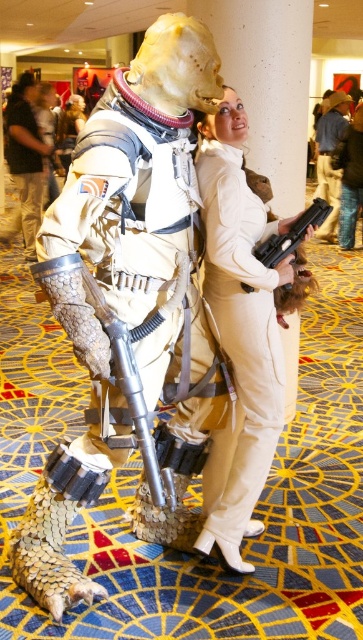
Question: Which is nearer to the matte white suit at center?

Choices:
 (A) matte white uniform at center
 (B) black plastic gun at center
 (C) metallic silver armor at left
 (D) polished silver rifle at center

Answer: (B)

Question: Does denim jacket at upper center appear on the right side of black plastic gun at center?

Choices:
 (A) no
 (B) yes

Answer: (B)

Question: Which of the following is the farthest from the observer?

Choices:
 (A) (317, 166)
 (B) (128, 122)
 (C) (84, 115)

Answer: (C)

Question: Which of the following is the closest to the observer?

Choices:
 (A) (132, 358)
 (B) (239, 141)

Answer: (A)

Question: Can you confirm if polished silver rifle at center is bigger than denim jacket at upper center?

Choices:
 (A) no
 (B) yes

Answer: (A)

Question: Does metallic armor at center appear under metallic silver armor at left?

Choices:
 (A) no
 (B) yes

Answer: (B)